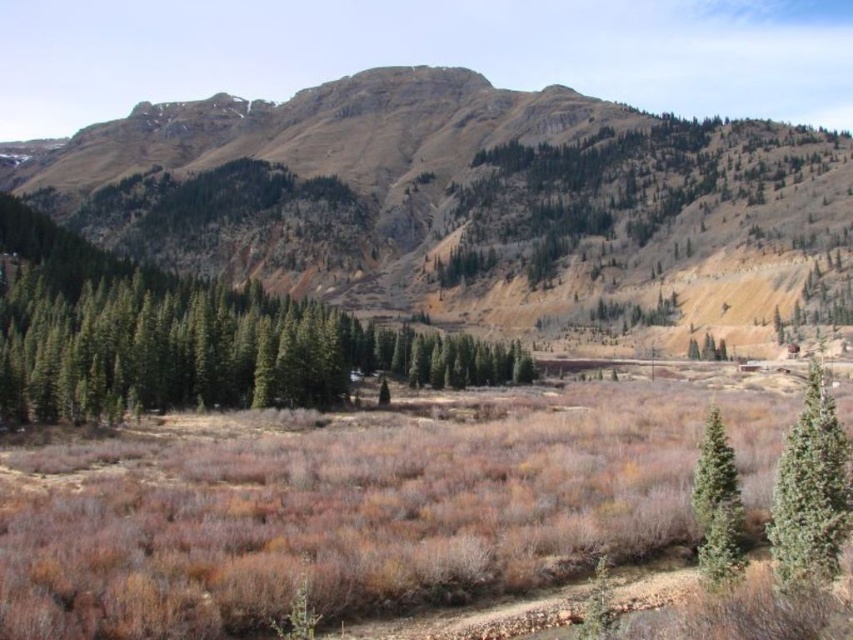
Does brown dry grass at center have a lesser width compared to green matte tree at left?

Indeed, brown dry grass at center has a lesser width compared to green matte tree at left.

Based on the photo, is brown dry grass at center wider than green matte tree at left?

No, brown dry grass at center is not wider than green matte tree at left.

Based on the photo, who is more distant from viewer, (668, 392) or (25, 300)?

The point (668, 392) is more distant.

Image resolution: width=853 pixels, height=640 pixels. Identify the location of brown dry grass at center. (338, 513).

Between point (792, 458) and point (714, 493), which one is positioned behind?

The point (714, 493) is behind.

Between green textured evergreen at lower right and green matte tree at lower right, which one has more height?

green textured evergreen at lower right is taller.

Locate an element on the screen. This screenshot has height=640, width=853. green textured evergreen at lower right is located at coordinates (810, 490).

Where is `green textured evergreen at lower right`? This screenshot has height=640, width=853. green textured evergreen at lower right is located at coordinates (810, 490).

Between brown dry grass at center and green textured evergreen at lower right, which one is positioned higher?

green textured evergreen at lower right

How far apart are brown dry grass at center and green textured evergreen at lower right?

brown dry grass at center and green textured evergreen at lower right are 33.55 meters apart from each other.

Find the location of a particular element. The image size is (853, 640). brown dry grass at center is located at coordinates (338, 513).

The height and width of the screenshot is (640, 853). In order to click on brown dry grass at center in this screenshot , I will do `click(338, 513)`.